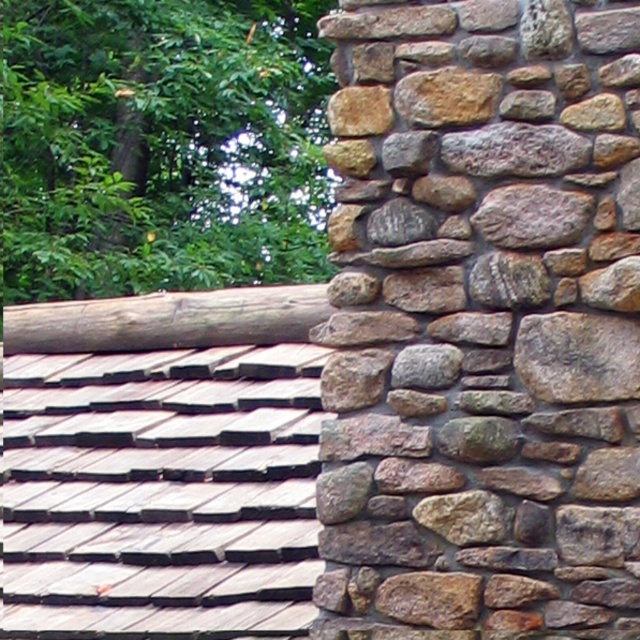
You are standing in front of the rustic stone wall and the roof with wooden shingles. There is a point marked at coordinates (481, 323). Based on the scene description, can you determine which object this point belongs to?

The point at coordinates (481, 323) is on the natural stone wall at right.

You are standing in front of a rustic stone wall and a log on the roof. You want to touch both the natural stone wall at right and the brown rough log at upper left. Which one can you reach without moving your position?

The natural stone wall at right is closer to the viewer than the brown rough log at upper left, so you can reach the natural stone wall at right without moving your position, but the brown rough log at upper left is farther away and may require moving closer.

Consider the image. You are an architect assessing the structural integrity of the natural stone wall at right and the brown rough log at upper left. Which object is taller and requires more attention in terms of height?

The natural stone wall at right is much taller than the brown rough log at upper left, so it requires more attention in terms of height.